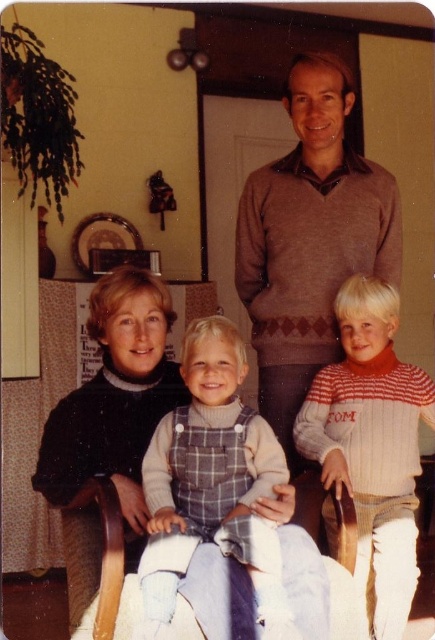
Question: Does brown sweater at center have a lesser width compared to wooden chair at center?

Choices:
 (A) yes
 (B) no

Answer: (A)

Question: Considering the real-world distances, which object is closest to the knitted sweater at right?

Choices:
 (A) plaid denim overalls at center
 (B) brown sweater at center
 (C) black sweater at center

Answer: (B)

Question: Which point is farther to the camera?

Choices:
 (A) (177, 620)
 (B) (236, 352)
 (C) (258, 227)

Answer: (C)

Question: Which of the following is the closest to the observer?

Choices:
 (A) pos(177,552)
 (B) pos(394,355)
 (C) pos(324,576)
 (D) pos(273,177)

Answer: (A)

Question: Does knitted sweater at right have a larger size compared to wooden chair at center?

Choices:
 (A) no
 (B) yes

Answer: (B)

Question: Observing the image, what is the correct spatial positioning of plaid denim overalls at center in reference to knitted sweater at right?

Choices:
 (A) right
 (B) left

Answer: (B)